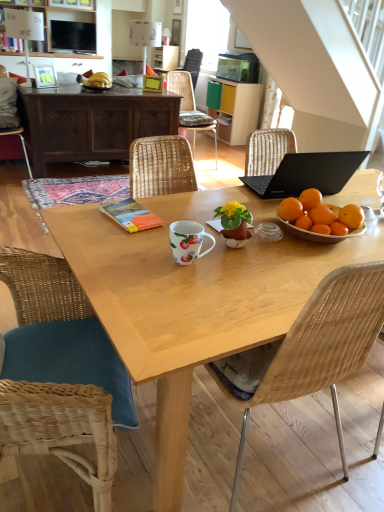
Find the location of `vacant space behind orange matte book at center`. vacant space behind orange matte book at center is located at coordinates (162, 200).